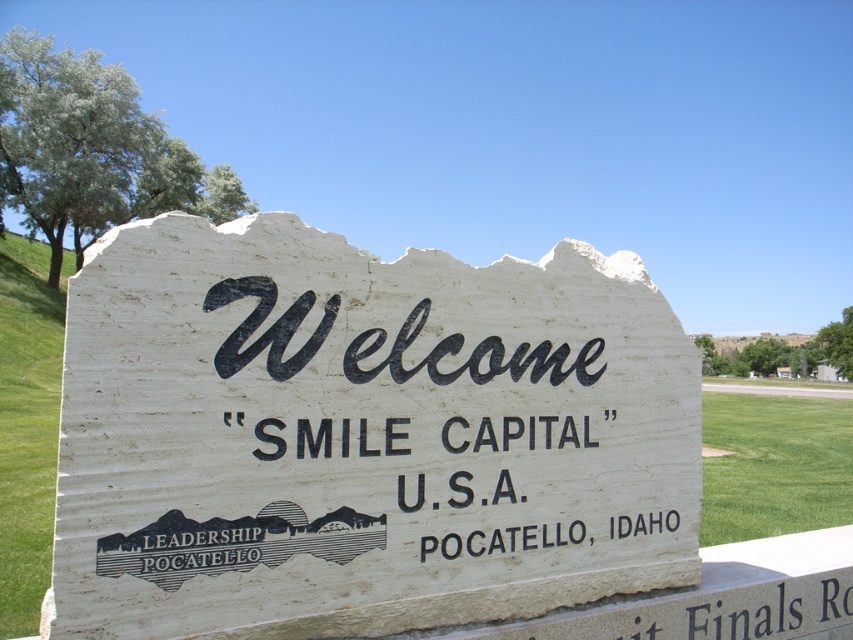
Is the position of white stone sign at center less distant than that of green grass at lower right?

Yes, it is in front of green grass at lower right.

Is point (300, 472) closer to camera compared to point (822, 428)?

Yes, point (300, 472) is in front of point (822, 428).

Which is behind, point (376, 404) or point (735, 524)?

Positioned behind is point (735, 524).

Find the location of a particular element. Image resolution: width=853 pixels, height=640 pixels. white stone sign at center is located at coordinates (361, 435).